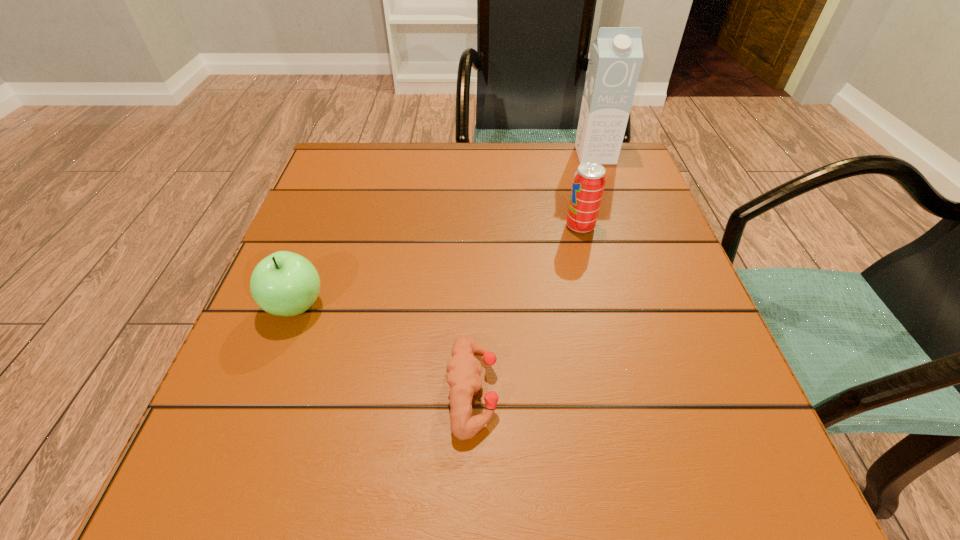
The height and width of the screenshot is (540, 960). What are the coordinates of `free space at the left edge of the desktop` in the screenshot? It's located at (331, 223).

This screenshot has width=960, height=540. Find the location of `vacant space at the right edge`. vacant space at the right edge is located at coordinates (678, 260).

This screenshot has width=960, height=540. Identify the location of vacant area at the near left corner of the desktop. (240, 469).

The image size is (960, 540). In order to click on blank space at the far right corner of the desktop in this screenshot , I will do `click(634, 166)`.

Identify the location of free region at the near right corner of the desktop. This screenshot has width=960, height=540. (722, 449).

Locate an element on the screen. This screenshot has height=540, width=960. vacant point located between the puncher and the leftmost object is located at coordinates (384, 349).

Locate an element on the screen. This screenshot has width=960, height=540. vacant space in between the second nearest object and the puncher is located at coordinates (384, 349).

At what (x,y) coordinates should I click in order to perform the action: click on vacant region between the third tallest object and the farthest object. Please return your answer as a coordinate pair (x, y). Image resolution: width=960 pixels, height=540 pixels. Looking at the image, I should click on (445, 231).

Identify the location of free space that is in between the nearest object and the third tallest object. (384, 349).

Where is `free space that is in between the leftmost object and the shortest object`? free space that is in between the leftmost object and the shortest object is located at coordinates (384, 349).